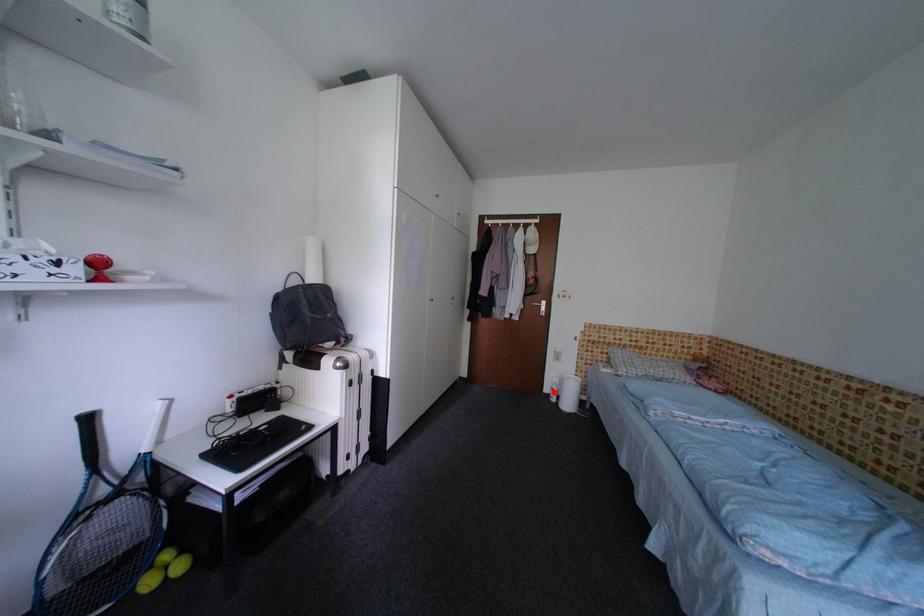
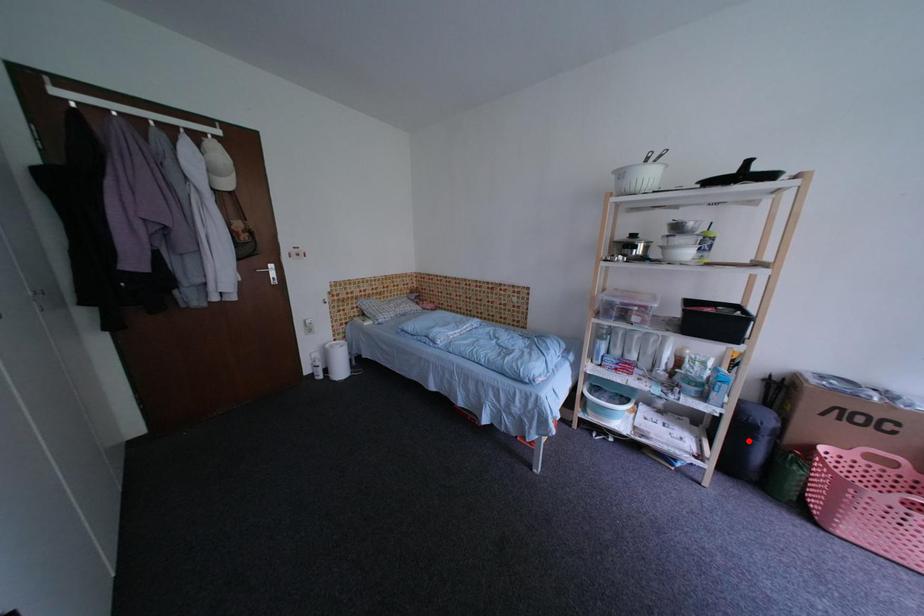
I am providing you with two images of the same scene from different viewpoints. A red point is marked on the first image and another point is marked on the second image. Are the points marked in image1 and image2 representing the same 3D position?

No